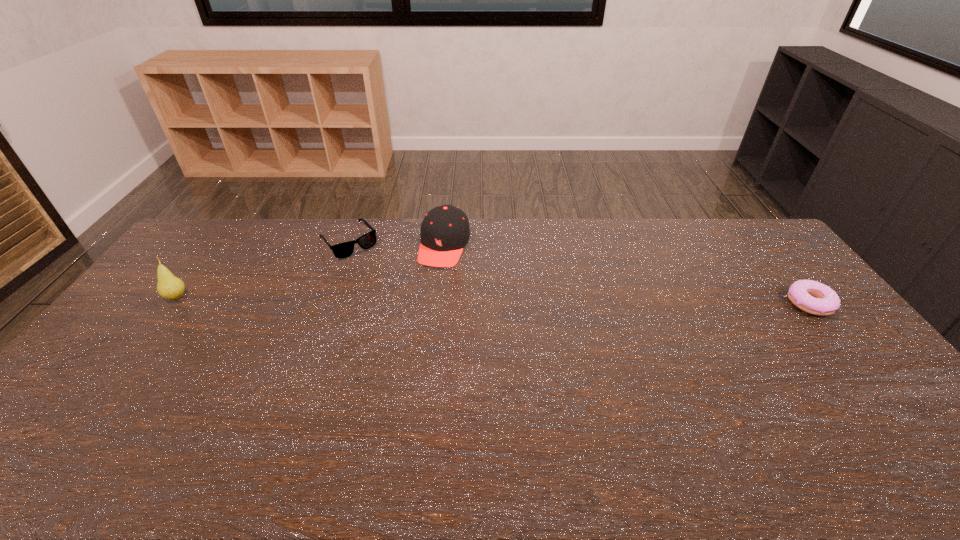
Where is `vacant region located 0.390m on the front-facing side of the second tallest object`? The height and width of the screenshot is (540, 960). vacant region located 0.390m on the front-facing side of the second tallest object is located at coordinates (404, 357).

Find the location of a particular element. The image size is (960, 540). vacant space located on the front-facing side of the second tallest object is located at coordinates (409, 344).

Image resolution: width=960 pixels, height=540 pixels. I want to click on vacant area situated on the front-facing side of the second shortest object, so click(392, 291).

Identify the location of vacant area located on the front-facing side of the second shortest object. Image resolution: width=960 pixels, height=540 pixels. (400, 301).

Locate an element on the screen. Image resolution: width=960 pixels, height=540 pixels. free location located on the front-facing side of the second shortest object is located at coordinates (402, 303).

In order to click on cap that is at the far edge in this screenshot , I will do `click(445, 231)`.

The image size is (960, 540). I want to click on sunglasses that is at the far edge, so click(342, 250).

This screenshot has height=540, width=960. In order to click on object located in the left edge section of the desktop in this screenshot , I will do `click(169, 287)`.

Find the location of a particular element. object that is at the right edge is located at coordinates (812, 297).

Where is `vacant space at the far edge of the desktop`? The image size is (960, 540). vacant space at the far edge of the desktop is located at coordinates [x=255, y=244].